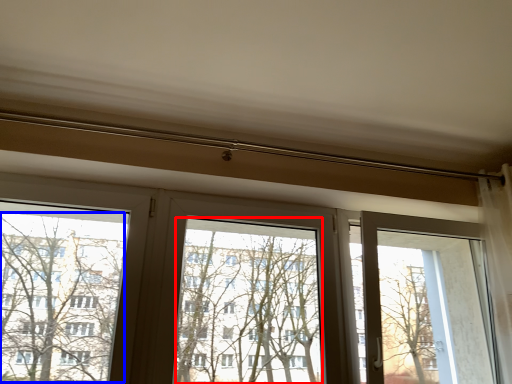
Question: Which object is further to the camera taking this photo, window screen (highlighted by a red box) or tree (highlighted by a blue box)?

Choices:
 (A) window screen
 (B) tree

Answer: (A)